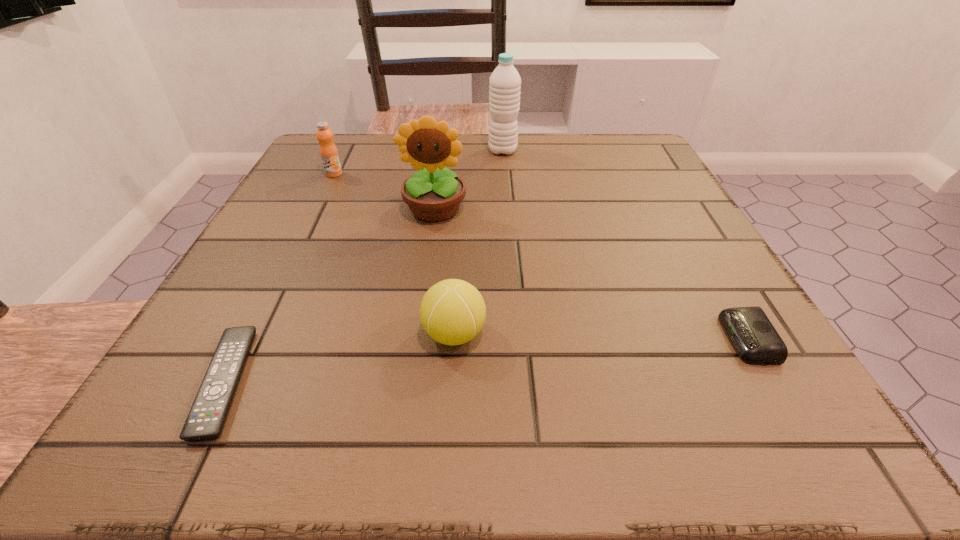
Where is `free location at the near left corner`? This screenshot has width=960, height=540. free location at the near left corner is located at coordinates (174, 436).

Image resolution: width=960 pixels, height=540 pixels. Identify the location of free region at the far right corner of the desktop. (658, 171).

Find the location of a particular element. The image size is (960, 540). empty location between the third shortest object and the rightmost object is located at coordinates (601, 336).

Where is `vacant space in between the water bottle and the third shortest object`? The height and width of the screenshot is (540, 960). vacant space in between the water bottle and the third shortest object is located at coordinates (478, 242).

In order to click on vacant space that is in between the remote control and the sunflower in this screenshot , I will do `click(330, 296)`.

The image size is (960, 540). In order to click on free point between the shortest object and the third farthest object in this screenshot , I will do `click(330, 296)`.

Where is `free space between the third tallest object and the sunflower`? free space between the third tallest object and the sunflower is located at coordinates (384, 192).

Find the location of `unoccupied area between the fourth nearest object and the fifth tallest object`. unoccupied area between the fourth nearest object and the fifth tallest object is located at coordinates (591, 274).

Locate an element on the screen. The width and height of the screenshot is (960, 540). free space between the fourth shortest object and the rightmost object is located at coordinates (540, 256).

Where is `vacant space that is in between the farthest object and the alarm clock`? Image resolution: width=960 pixels, height=540 pixels. vacant space that is in between the farthest object and the alarm clock is located at coordinates (625, 245).